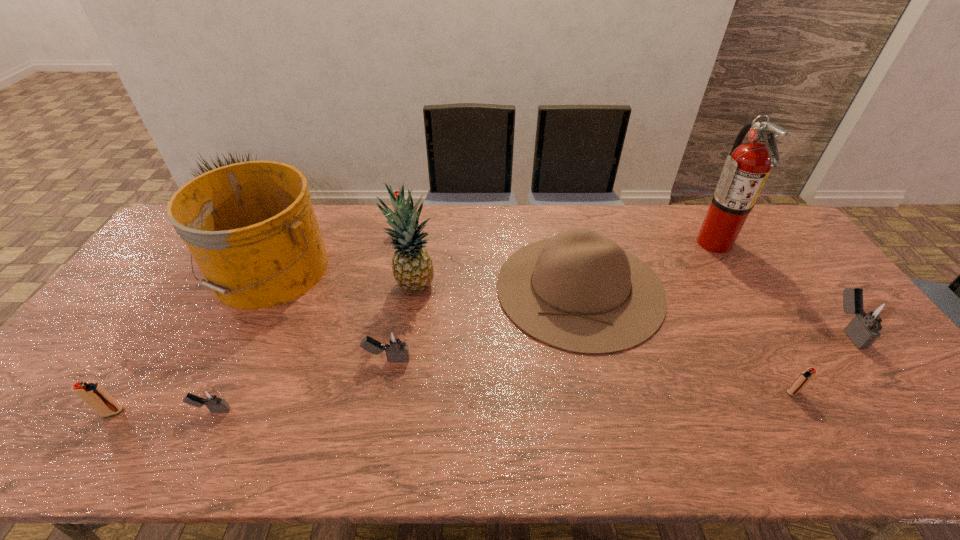
The image size is (960, 540). I want to click on vacant point located 0.060m on the left of the smallest gray igniter, so click(168, 410).

At what (x,y) coordinates should I click in order to perform the action: click on fire extinguisher located in the far edge section of the desktop. Please return your answer as a coordinate pair (x, y). The height and width of the screenshot is (540, 960). Looking at the image, I should click on (746, 169).

You are a GUI agent. You are given a task and a screenshot of the screen. Output one action in this format:
    pyautogui.click(x=<x>, y=<y>)
    Task: Click on the bucket that is at the far edge
    The width and height of the screenshot is (960, 540).
    Given the screenshot: What is the action you would take?
    pyautogui.click(x=251, y=228)

The image size is (960, 540). Find the location of `sombrero that is at the far edge`. sombrero that is at the far edge is located at coordinates (579, 291).

The image size is (960, 540). I want to click on igniter that is at the far edge, so click(x=396, y=193).

Locate an element on the screen. object that is positioned at the right edge is located at coordinates (863, 329).

This screenshot has height=540, width=960. I want to click on free space at the far edge of the desktop, so click(569, 224).

At what (x,y) coordinates should I click in order to perform the action: click on vacant space at the near edge. Please return your answer as a coordinate pair (x, y). This screenshot has height=540, width=960. Looking at the image, I should click on (238, 459).

Locate an element on the screen. This screenshot has width=960, height=540. free space at the left edge is located at coordinates (47, 393).

Locate an element on the screen. blank space at the right edge of the desktop is located at coordinates (896, 412).